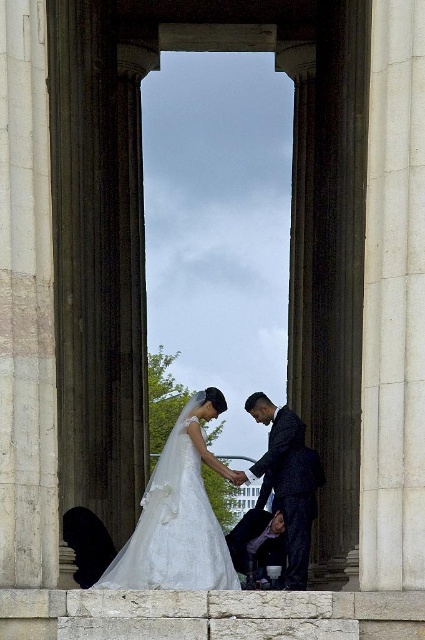
You are standing in the wedding scene and want to place a bouquet between the two points, point (101, 582) and point (282, 566). Which point should the bouquet be closer to in order to appear more prominent in the photo?

The bouquet should be placed closer to point (101, 582) because it is closer to the viewer, making it more prominent in the photo.

You are a photographer planning to capture a portrait of the couple in the wedding scene. Given that the white satin dress at center is taller than the dark blue textured suit at center, how should you adjust your camera angle to ensure both subjects are in focus and properly framed?

Since the white satin dress at center is taller than the dark blue textured suit at center, you should position the camera slightly lower to include the full height of the dress while keeping the groom in frame. This angle will balance the composition and ensure both are clearly visible.